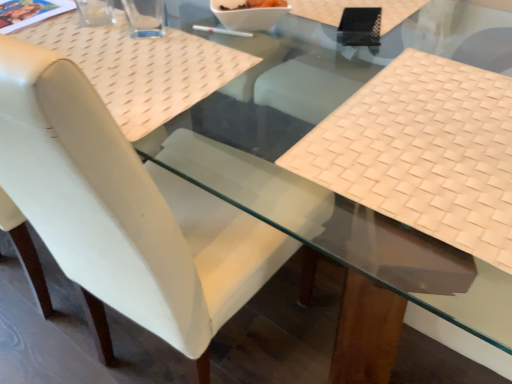
The image size is (512, 384). Identify the location of vacant space positioned to the left of transparent glass cup at upper left, the second clear positioned from the right. (53, 23).